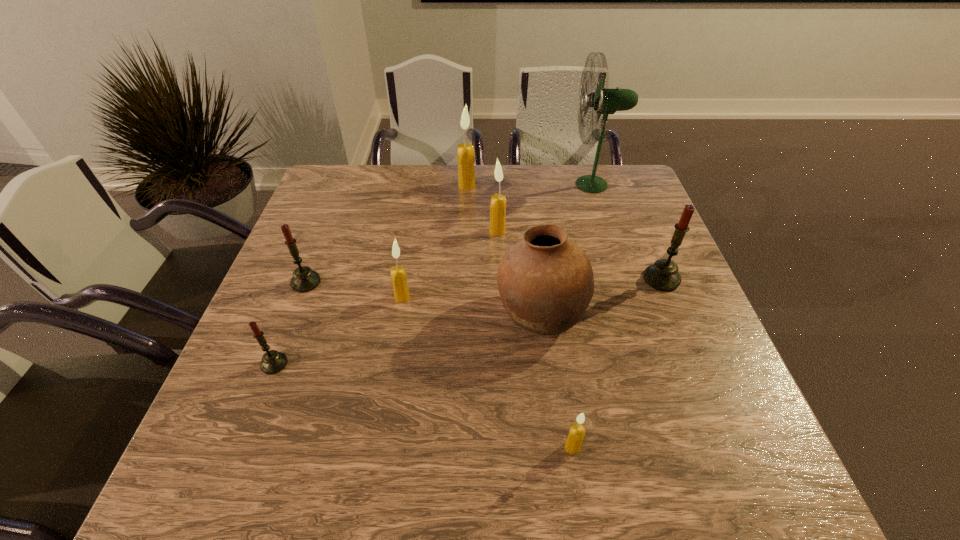
In order to click on the third farthest cream candle in this screenshot , I will do `click(398, 275)`.

Locate an element on the screen. The width and height of the screenshot is (960, 540). the third candle from left to right is located at coordinates (398, 275).

The image size is (960, 540). I want to click on the nearest red candle, so click(x=273, y=361).

The width and height of the screenshot is (960, 540). I want to click on the second nearest candle, so click(273, 361).

Identify the location of the nearest candle. The height and width of the screenshot is (540, 960). (573, 443).

The height and width of the screenshot is (540, 960). I want to click on the smallest cream candle, so click(573, 443).

What are the coordinates of `vacant space located on the front-facing side of the tallest object` in the screenshot? It's located at (528, 185).

Find the location of `free space located on the front-facing side of the tallest object`. free space located on the front-facing side of the tallest object is located at coordinates (503, 185).

Image resolution: width=960 pixels, height=540 pixels. In order to click on free space located on the front-facing side of the tallest object in this screenshot , I will do (477, 185).

This screenshot has height=540, width=960. I want to click on vacant area situated on the left of the second tallest object, so click(341, 186).